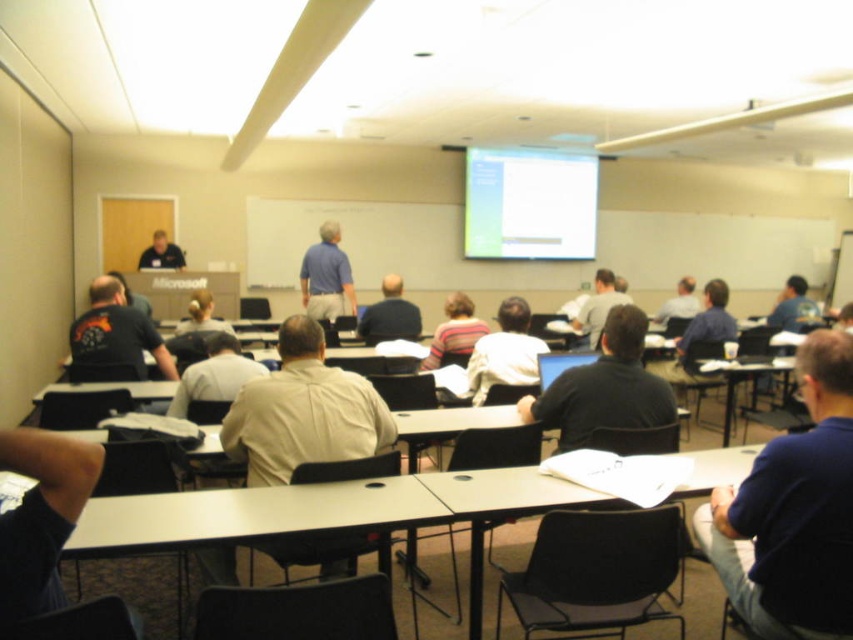
Question: Among these points, which one is nearest to the camera?

Choices:
 (A) (781, 371)
 (B) (456, 497)

Answer: (B)

Question: Which object appears closest to the camera in this image?

Choices:
 (A) blonde hair at center
 (B) blue shirt at right

Answer: (A)

Question: From the image, what is the correct spatial relationship of dark blue shirt at right in relation to light brown shirt at center?

Choices:
 (A) left
 (B) right

Answer: (A)

Question: Among these points, which one is nearest to the camera?

Choices:
 (A) (822, 630)
 (B) (190, 374)
 (C) (477, 323)

Answer: (A)

Question: Is striped cotton shirt at center smaller than blue shirt at right?

Choices:
 (A) no
 (B) yes

Answer: (B)

Question: Does black matte laptop at center have a larger size compared to blue cotton shirt at center?

Choices:
 (A) no
 (B) yes

Answer: (B)